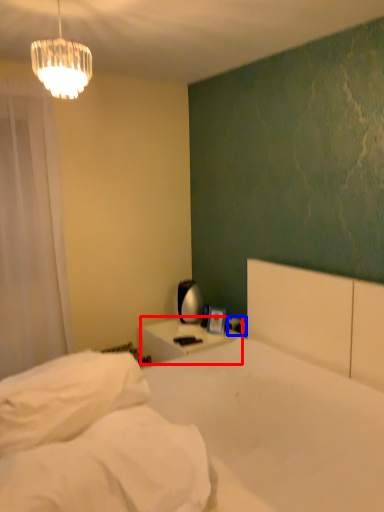
Question: Which object appears farthest to the camera in this image, nightstand (highlighted by a red box) or electric outlet (highlighted by a blue box)?

Choices:
 (A) nightstand
 (B) electric outlet

Answer: (B)